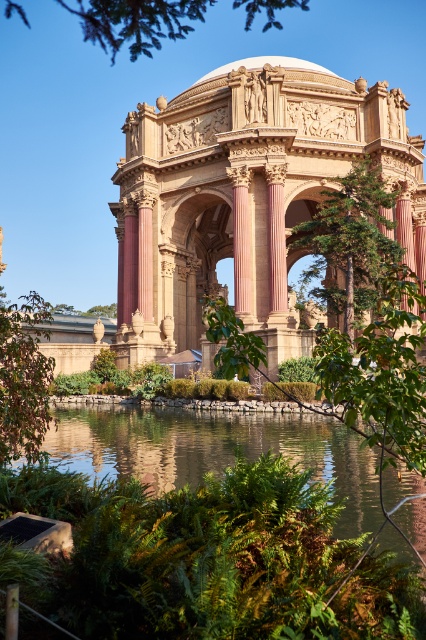
Question: Where is green leafy tree at center located in relation to green leafy tree at lower left in the image?

Choices:
 (A) left
 (B) right

Answer: (B)

Question: Estimate the real-world distances between objects in this image. Which object is closer to the golden stone palace at center?

Choices:
 (A) green leafy tree at lower left
 (B) green leafy tree at upper center

Answer: (B)

Question: Is golden stone palace at center below green leafy tree at upper center?

Choices:
 (A) yes
 (B) no

Answer: (A)

Question: Which point is farther from the camera taking this photo?

Choices:
 (A) (370, 164)
 (B) (175, 170)
 (C) (192, 445)
 (D) (42, 312)

Answer: (B)

Question: Which point appears farthest from the camera in this image?

Choices:
 (A) (103, 35)
 (B) (284, 202)
 (C) (71, 445)
 (D) (357, 180)

Answer: (B)

Question: Considering the relative positions of golden stone palace at center and clear water at center in the image provided, where is golden stone palace at center located with respect to clear water at center?

Choices:
 (A) left
 (B) right

Answer: (B)